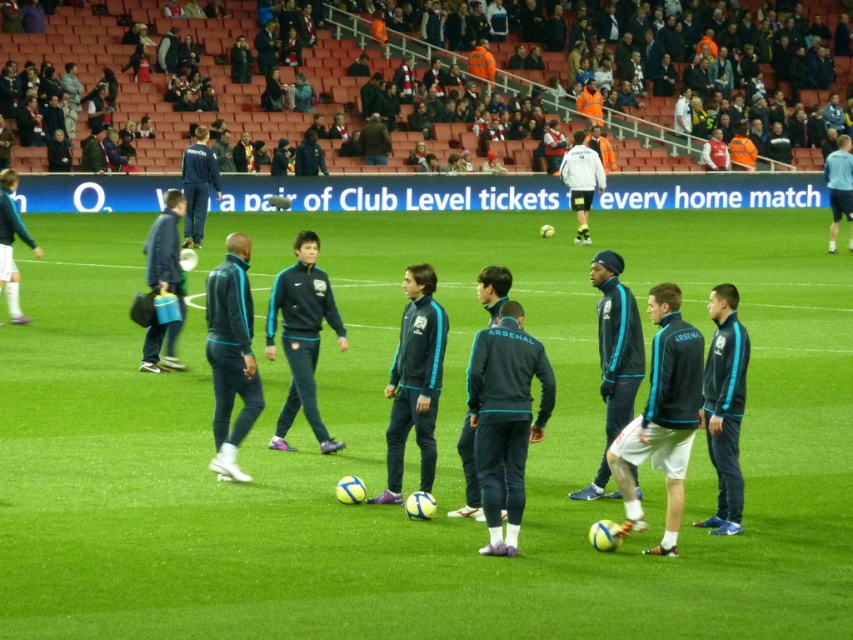
Question: Is blue fabric jacket at left bigger than light blue fabric jacket at upper right?

Choices:
 (A) no
 (B) yes

Answer: (A)

Question: In this image, where is dark blue fabric jacket at center located relative to light blue fabric jacket at upper right?

Choices:
 (A) left
 (B) right

Answer: (A)

Question: Which object is the farthest from the white matte jacket at center?

Choices:
 (A) blue fabric jacket at left
 (B) dark blue fabric jacket at center
 (C) green grass field at center

Answer: (B)

Question: Estimate the real-world distances between objects in this image. Which object is closer to the blue fabric jacket at left?

Choices:
 (A) dark blue fabric jacket at center
 (B) teal fabric jacket at center
 (C) white matte jacket at center
 (D) dark blue tracksuit at center

Answer: (A)

Question: Is leather jacket at center smaller than teal fabric tracksuit at center?

Choices:
 (A) yes
 (B) no

Answer: (B)

Question: Which object is positioned closest to the green grass field at center?

Choices:
 (A) dark blue tracksuit at center
 (B) teal fabric jacket at center

Answer: (B)